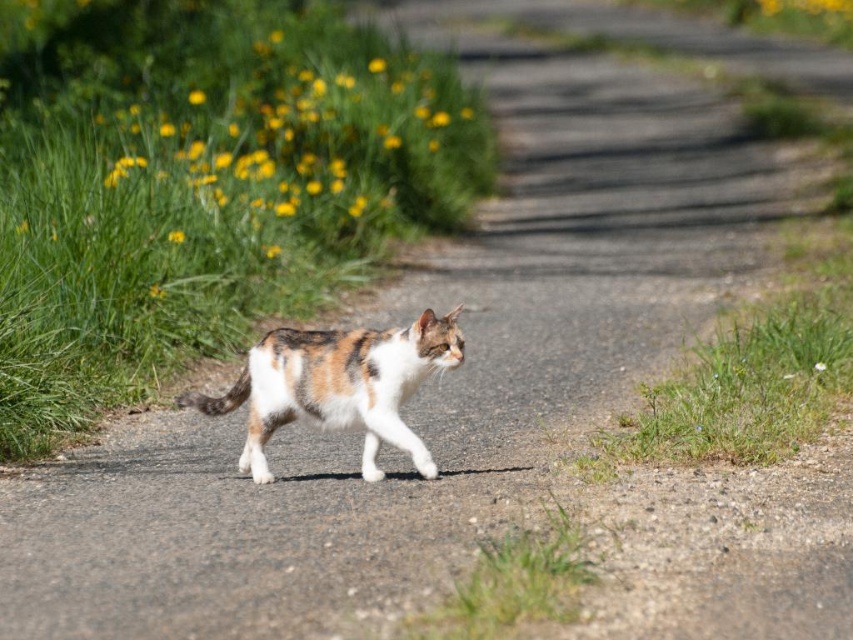
Who is positioned more to the right, green grass at center or yellow grass at upper left?

Positioned to the right is yellow grass at upper left.

Between point (474, 140) and point (294, 77), which one is positioned in front?

Point (294, 77)

This screenshot has height=640, width=853. I want to click on green grass at center, so click(x=201, y=184).

Can you confirm if yellow grass at upper left is taller than white matte flower at center?

Correct, yellow grass at upper left is much taller as white matte flower at center.

Based on the photo, can you confirm if yellow grass at upper left is positioned above white matte flower at center?

Indeed, yellow grass at upper left is positioned over white matte flower at center.

Is point (305, 17) behind point (817, 369)?

Yes, it is.

You are a GUI agent. You are given a task and a screenshot of the screen. Output one action in this format:
    pyautogui.click(x=<x>, y=<y>)
    Task: Click on the yellow grass at upper left
    The width and height of the screenshot is (853, 640).
    Given the screenshot: What is the action you would take?
    pyautogui.click(x=279, y=138)

This screenshot has height=640, width=853. Describe the element at coordinates (337, 385) in the screenshot. I see `calico fur cat at center` at that location.

Who is more distant from viewer, (263, 387) or (821, 364)?

Positioned behind is point (821, 364).

At what (x,y) coordinates should I click in order to perform the action: click on calico fur cat at center. Please return your answer as a coordinate pair (x, y). This screenshot has width=853, height=640. Looking at the image, I should click on (337, 385).